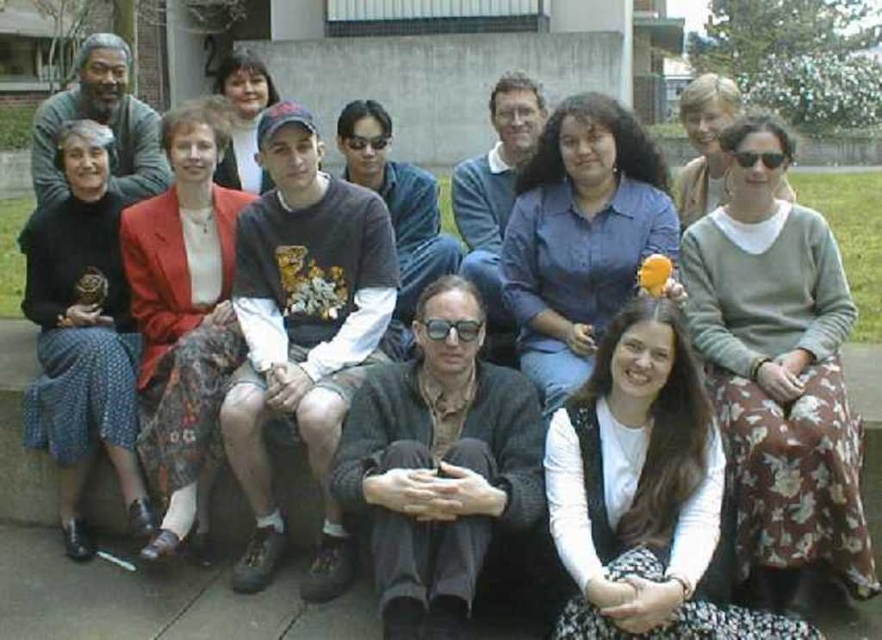
You are a photographer trying to adjust the composition of the group photo. You notice the matte red blazer at center and the polka dot skirt at lower left. Which object is located closer to the bottom of the image?

The polka dot skirt at lower left is closer to the bottom of the image because the matte red blazer at center is positioned under it.

You are a photographer trying to adjust the spacing between the blue sweater at center and the dark gray sweater at center in the front row. Based on their sizes, which sweater should you move closer to the camera to make them appear more balanced in the photo?

The blue sweater at center has a lesser width compared to dark gray sweater at center, so you should move the blue sweater at center closer to the camera to make it appear larger and more balanced with the wider dark gray sweater at center.